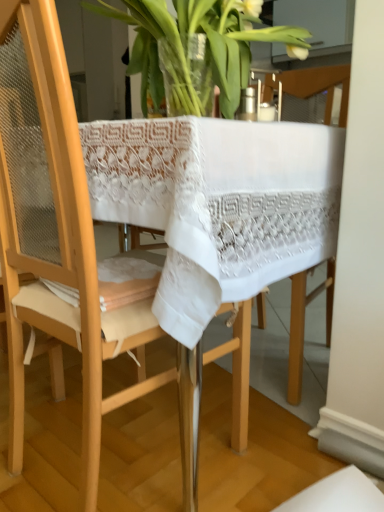
Question: Considering the positions of point (61, 138) and point (258, 36), is point (61, 138) closer or farther from the camera than point (258, 36)?

Choices:
 (A) closer
 (B) farther

Answer: (A)

Question: Visually, is wooden chair at center positioned to the left or to the right of translucent glass vase at upper center?

Choices:
 (A) left
 (B) right

Answer: (A)

Question: Is wooden chair at center spatially inside translucent glass vase at upper center, or outside of it?

Choices:
 (A) outside
 (B) inside

Answer: (A)

Question: Is translucent glass vase at upper center spatially inside wooden chair at center, or outside of it?

Choices:
 (A) inside
 (B) outside

Answer: (A)

Question: Considering the positions of translucent glass vase at upper center and wooden chair at center in the image, is translucent glass vase at upper center wider or thinner than wooden chair at center?

Choices:
 (A) thin
 (B) wide

Answer: (A)

Question: Considering the positions of translucent glass vase at upper center and wooden chair at center in the image, is translucent glass vase at upper center bigger or smaller than wooden chair at center?

Choices:
 (A) big
 (B) small

Answer: (B)

Question: Considering their positions, is translucent glass vase at upper center located in front of or behind wooden chair at center?

Choices:
 (A) front
 (B) behind

Answer: (B)